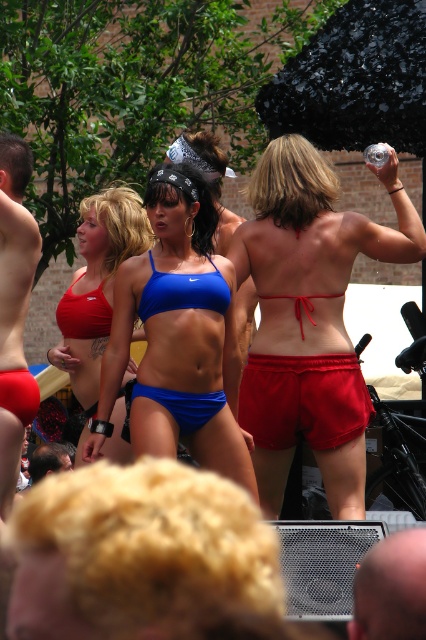
You are standing at the center of the image and want to locate the matte blue bikini top at center. According to the coordinates provided, in which direction should you look to find it?

The matte blue bikini top at center is located at coordinates point [97,285], so you should look slightly to the right and downward from the very center of the image to find it.

You are at a beach party and see the red satin shorts at upper center and the matte blue bikini top at center. Which clothing item is taller?

The red satin shorts at upper center has a greater height compared to the matte blue bikini top at center.